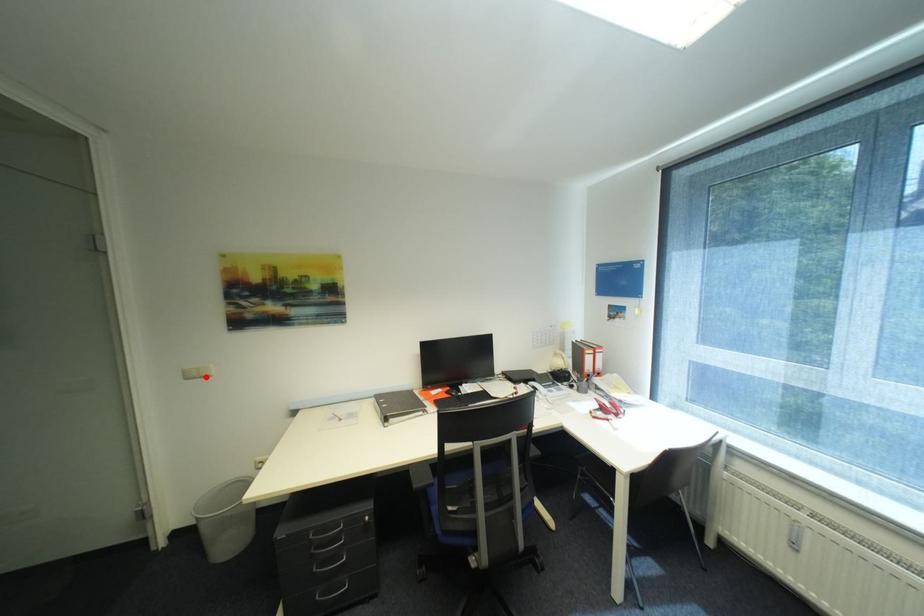
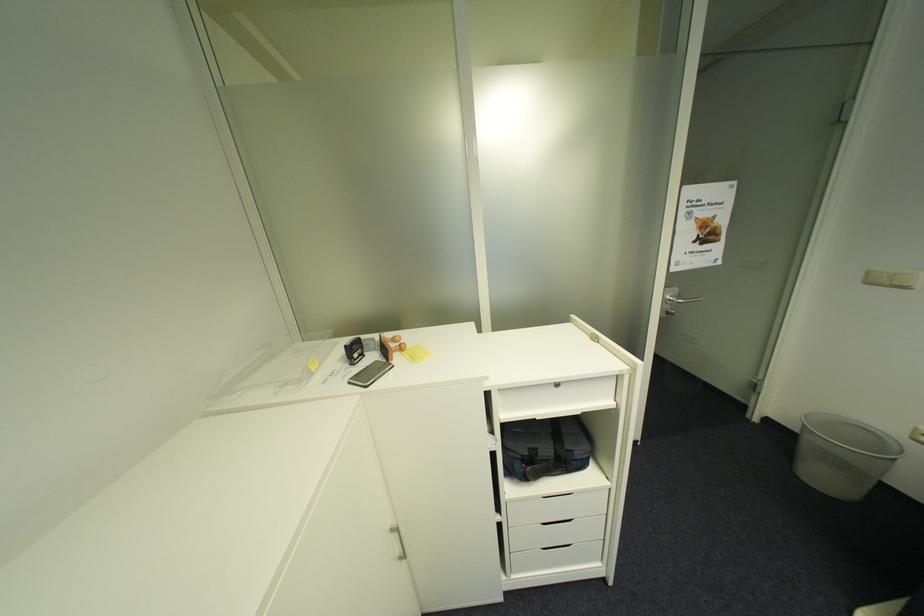
Where in the second image is the point corresponding to the highlighted location from the first image?

(895, 285)